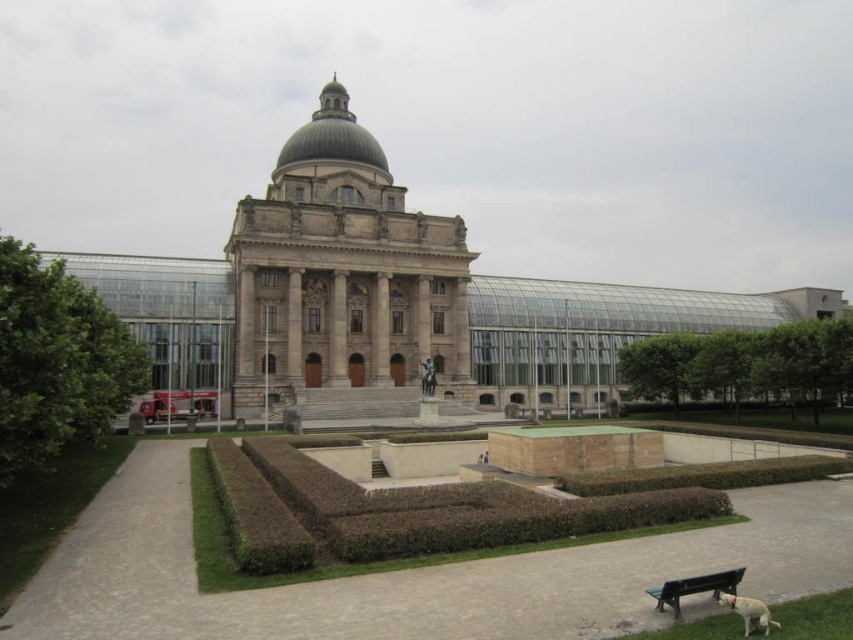
Question: Does green leafy hedge at left have a larger size compared to white fur dog at lower right?

Choices:
 (A) yes
 (B) no

Answer: (A)

Question: Which of these objects is positioned closest to the green plastic bench at lower right?

Choices:
 (A) white fur dog at lower right
 (B) stone statue at center
 (C) green leafy hedge at left

Answer: (A)

Question: Does green leafy hedge at left appear on the left side of green plastic bench at lower right?

Choices:
 (A) yes
 (B) no

Answer: (A)

Question: Which of the following is the closest to the observer?

Choices:
 (A) green plastic bench at lower right
 (B) green leafy hedge at left
 (C) green leafy hedge at right

Answer: (A)

Question: Which point is closer to the camera?

Choices:
 (A) green leafy hedge at left
 (B) green plastic bench at lower right
 (C) white fur dog at lower right

Answer: (C)

Question: In this image, where is green leafy hedge at left located relative to green leafy hedge at right?

Choices:
 (A) right
 (B) left

Answer: (B)